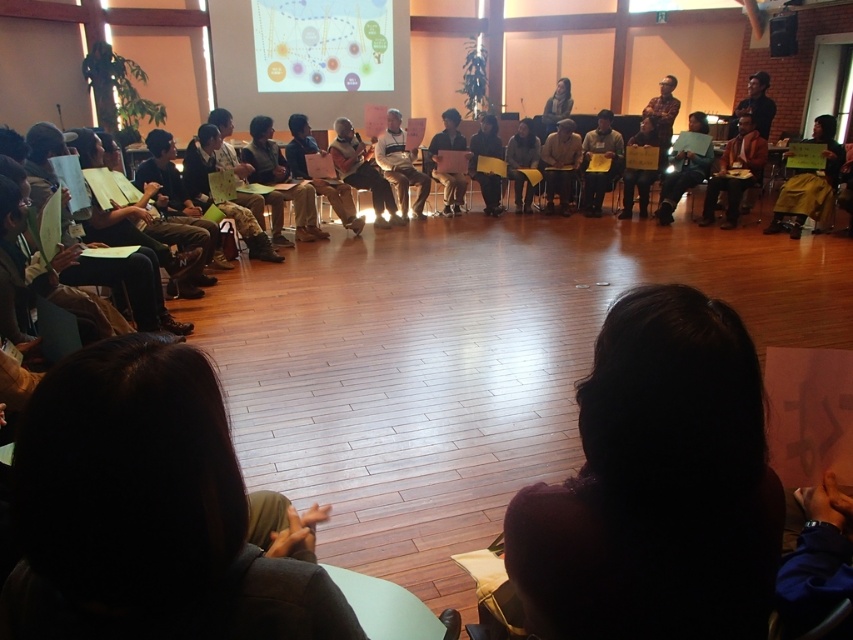
Question: Based on their relative distances, which object is nearer to the brown cardboard sign at center?

Choices:
 (A) yellow fabric at right
 (B) matte black laptop at center
 (C) matte brown jacket at center
 (D) dark hair at lower center

Answer: (A)

Question: Which of the following is the farthest from the observer?

Choices:
 (A) (550, 118)
 (B) (686, 170)
 (C) (814, 205)
 (D) (344, 40)

Answer: (A)

Question: Considering the real-world distances, which object is farthest from the matte black laptop at center?

Choices:
 (A) dark blue shirt at center
 (B) dark hair at lower center

Answer: (B)

Question: In this image, where is dark brown hair at lower left located relative to brown cardboard sign at center?

Choices:
 (A) right
 (B) left

Answer: (B)

Question: Does white fabric shirt at center appear over matte brown shirt at center?

Choices:
 (A) no
 (B) yes

Answer: (A)

Question: Is light gray sweater at center above brown cardboard sign at center?

Choices:
 (A) yes
 (B) no

Answer: (B)